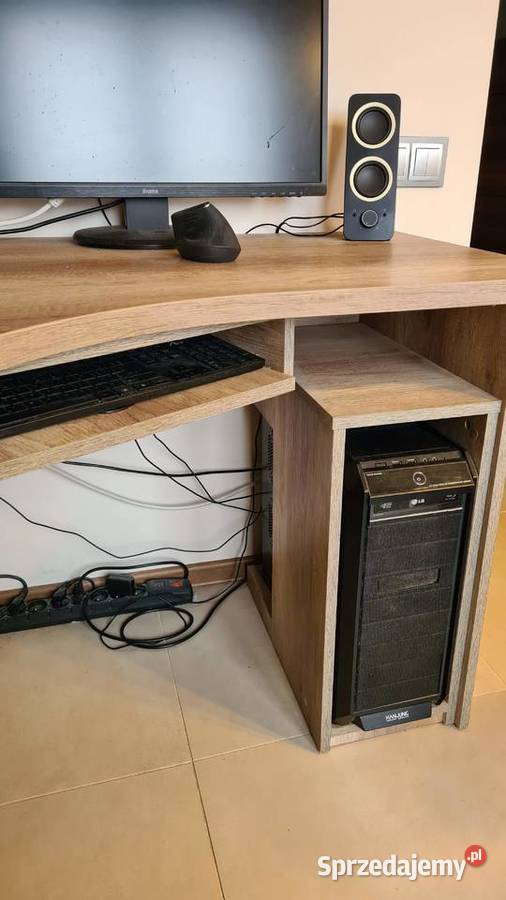
Locate an element on the screen. speaker is located at coordinates (388, 153).